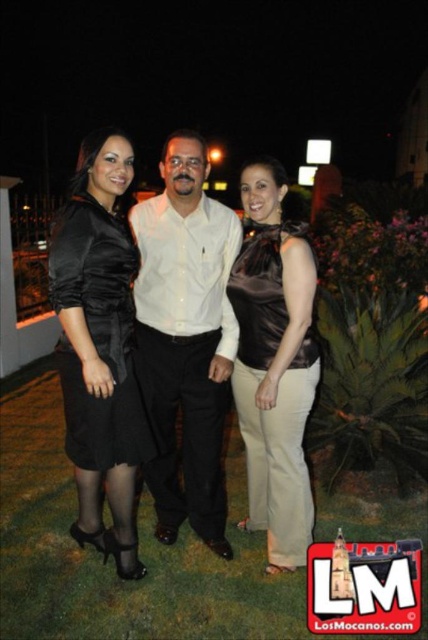
Question: Can you confirm if satin black dress at left is wider than satin brown top at center?

Choices:
 (A) no
 (B) yes

Answer: (A)

Question: Does white smooth shirt at center come behind satin brown dress at center?

Choices:
 (A) no
 (B) yes

Answer: (A)

Question: Is satin black dress at center bigger than satin black dress at left?

Choices:
 (A) no
 (B) yes

Answer: (B)

Question: Among these points, which one is farthest from the camera?

Choices:
 (A) (285, 324)
 (B) (107, 326)
 (C) (225, 390)
 (D) (256, 371)

Answer: (C)

Question: Which point is closer to the camera?

Choices:
 (A) satin brown top at center
 (B) satin black dress at center
 (C) satin brown dress at center

Answer: (B)

Question: Which object is closer to the camera taking this photo?

Choices:
 (A) white smooth shirt at center
 (B) satin brown dress at center
 (C) satin black dress at center

Answer: (A)